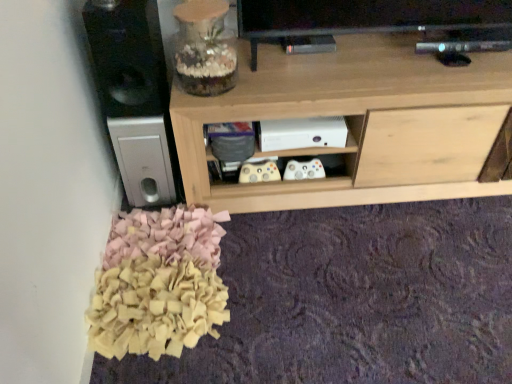
This screenshot has width=512, height=384. What do you see at coordinates (358, 123) in the screenshot?
I see `light wood shelf at center` at bounding box center [358, 123].

At what (x,y) coordinates should I click in order to perform the action: click on light wood shelf at center. Please return your answer as a coordinate pair (x, y). Image resolution: width=512 pixels, height=384 pixels. Looking at the image, I should click on (358, 123).

The height and width of the screenshot is (384, 512). What do you see at coordinates (127, 56) in the screenshot?
I see `black matte speaker at left` at bounding box center [127, 56].

Find the location of a particular element. The width and height of the screenshot is (512, 384). black matte speaker at left is located at coordinates (127, 56).

This screenshot has height=384, width=512. What are the coordinates of `light wood shelf at center` in the screenshot? It's located at (358, 123).

Which is more to the right, black matte speaker at left or light wood shelf at center?

Result: Positioned to the right is light wood shelf at center.

Is black matte speaker at left in front of or behind light wood shelf at center in the image?

In the image, black matte speaker at left appears in front of light wood shelf at center.

Between point (105, 30) and point (452, 77), which one is positioned in front?

The point (105, 30) is closer.

From the image's perspective, is black matte speaker at left above or below light wood shelf at center?

black matte speaker at left is situated higher than light wood shelf at center in the image.

From a real-world perspective, relative to light wood shelf at center, is black matte speaker at left vertically above or below?

black matte speaker at left is situated higher than light wood shelf at center in the real world.

In terms of width, does black matte speaker at left look wider or thinner when compared to light wood shelf at center?

In the image, black matte speaker at left appears to be more narrow than light wood shelf at center.

Which of these two, black matte speaker at left or light wood shelf at center, stands taller?

Answer: light wood shelf at center is taller.

Consider the image. In terms of size, does black matte speaker at left appear bigger or smaller than light wood shelf at center?

In the image, black matte speaker at left appears to be smaller than light wood shelf at center.

Can light wood shelf at center be found inside black matte speaker at left?

No, light wood shelf at center is not a part of black matte speaker at left.

Is black matte speaker at left next to light wood shelf at center and touching it?

No, black matte speaker at left is not in contact with light wood shelf at center.

Is black matte speaker at left facing towards light wood shelf at center?

No, black matte speaker at left is not aimed at light wood shelf at center.

Find the location of a particular element. This screenshot has height=384, width=512. speaker that appears above the light wood shelf at center (from the image's perspective) is located at coordinates (127, 56).

Which is more to the right, light wood shelf at center or black matte speaker at left?

From the viewer's perspective, light wood shelf at center appears more on the right side.

In the image, is light wood shelf at center positioned in front of or behind black matte speaker at left?

Clearly, light wood shelf at center is behind black matte speaker at left.

Does point (190, 144) lie in front of point (163, 93)?

That is False.

From the image's perspective, is light wood shelf at center beneath black matte speaker at left?

Correct, light wood shelf at center appears lower than black matte speaker at left in the image.

From a real-world perspective, which is physically above, light wood shelf at center or black matte speaker at left?

black matte speaker at left is physically above.

Which of these two, light wood shelf at center or black matte speaker at left, is thinner?

black matte speaker at left is thinner.

Between light wood shelf at center and black matte speaker at left, which one has less height?

black matte speaker at left is shorter.

Is light wood shelf at center smaller than black matte speaker at left?

No.

Would you say light wood shelf at center is inside or outside black matte speaker at left?

The correct answer is: outside.

Is light wood shelf at center next to black matte speaker at left?

No.

Is light wood shelf at center oriented towards black matte speaker at left?

No.

Identify the location of shelf on the right of black matte speaker at left. (358, 123).

The height and width of the screenshot is (384, 512). In order to click on shelf below the black matte speaker at left (from a real-world perspective) in this screenshot , I will do `click(358, 123)`.

The width and height of the screenshot is (512, 384). What are the coordinates of `speaker on the left of light wood shelf at center` in the screenshot? It's located at (127, 56).